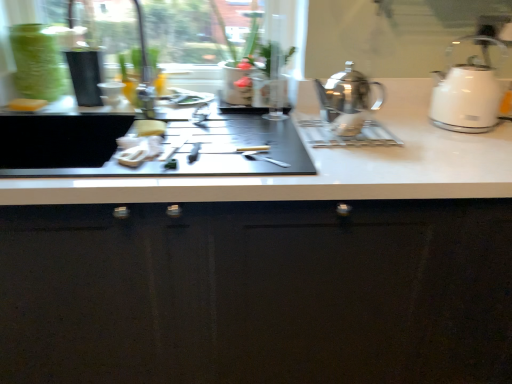
In order to click on vacant area to the left of white glossy kettle at right, acting as the 1th kettle starting from the right in this screenshot , I will do `click(408, 126)`.